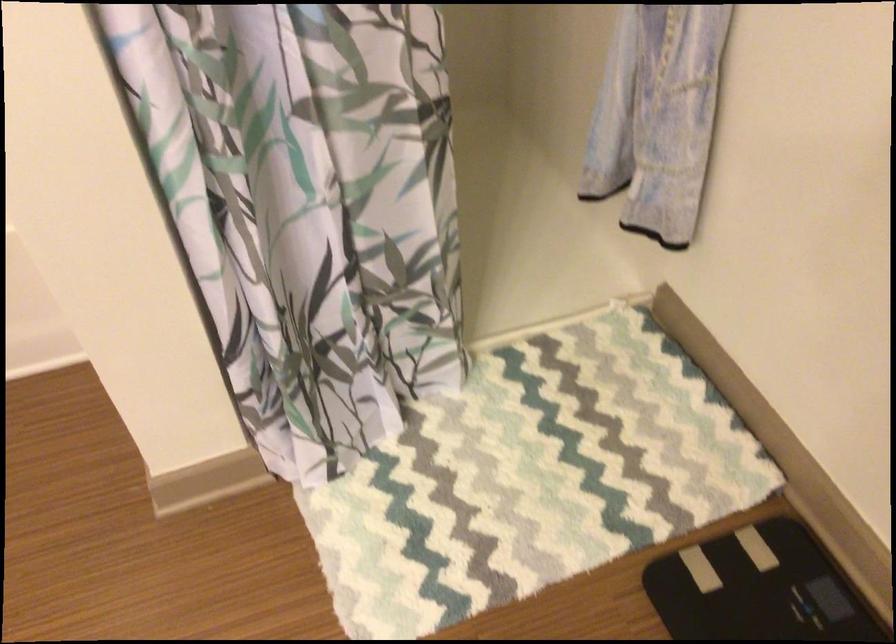
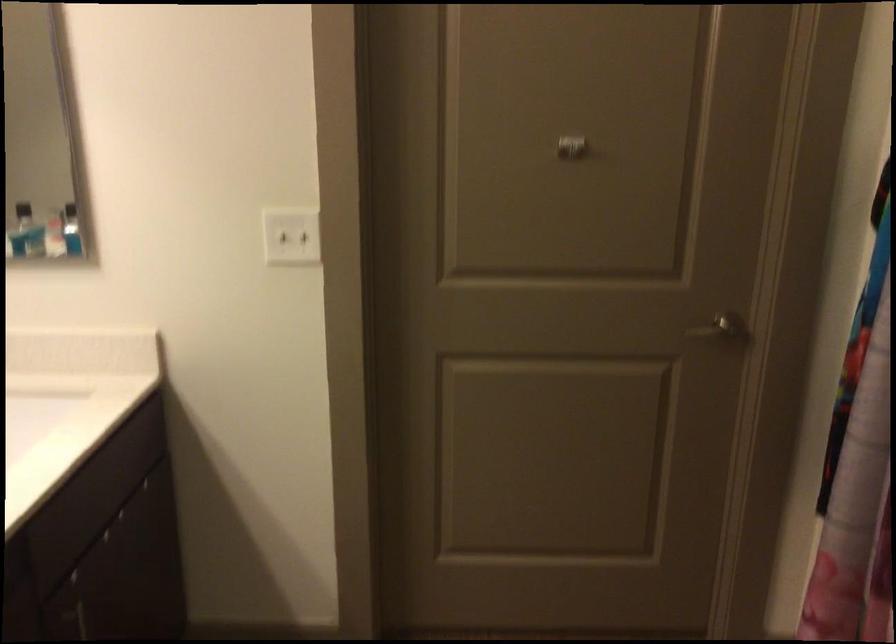
First-person continuous shooting, in which direction is the camera rotating?

The rotation direction of the camera is left-down.